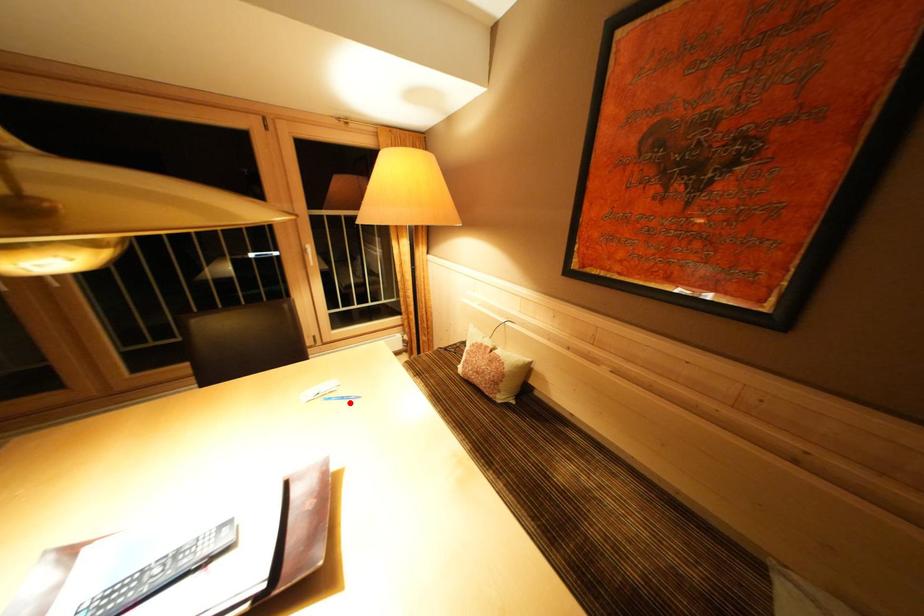
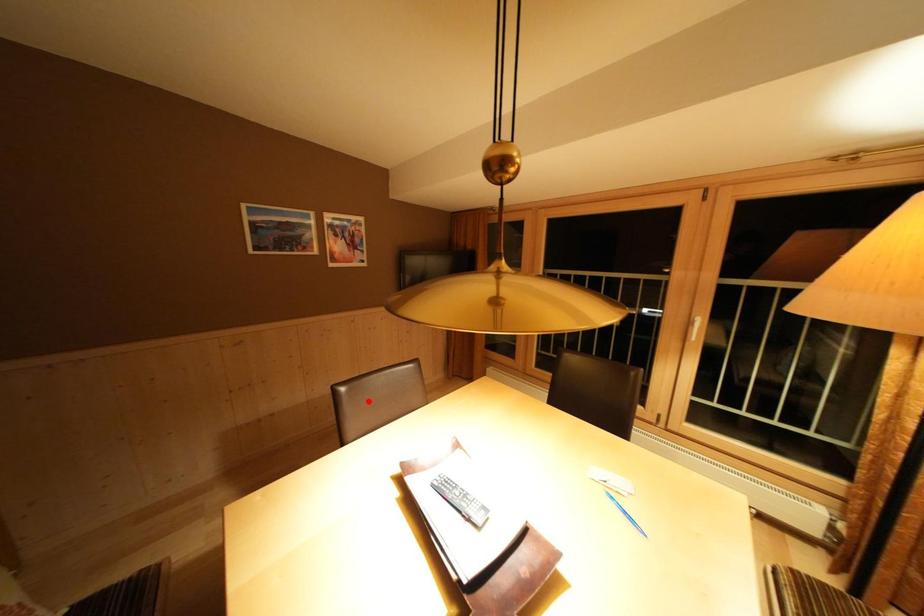
I am providing you with two images of the same scene from different viewpoints. A red point is marked on the first image and another point is marked on the second image. Is the red point in image1 aligned with the point shown in image2?

No